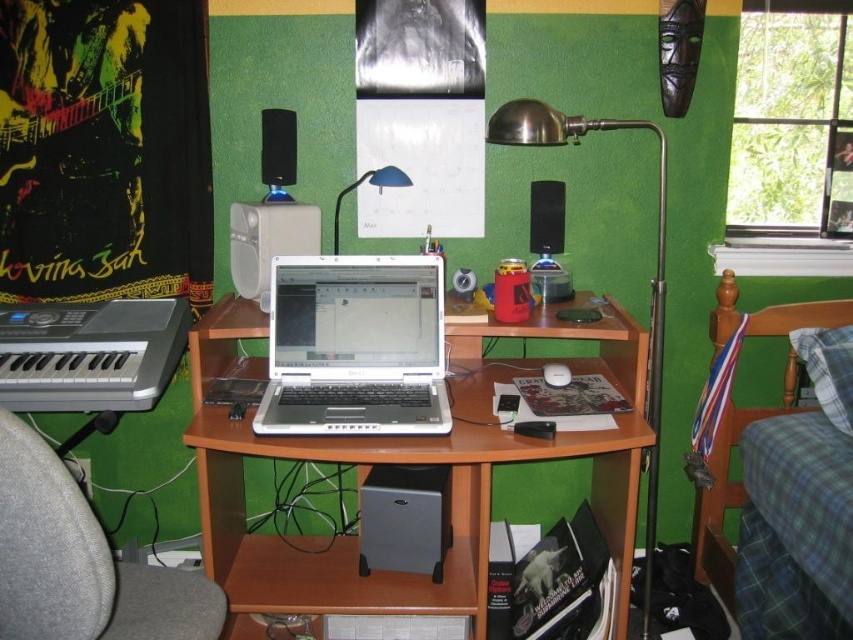
Question: Which point is closer to the camera?

Choices:
 (A) (723, 477)
 (B) (271, 163)
 (C) (393, 168)
 (D) (558, 244)

Answer: (C)

Question: Is gray fabric swivel chair at left bigger than black plastic speaker at upper center?

Choices:
 (A) no
 (B) yes

Answer: (B)

Question: Is gray fabric swivel chair at left behind blue metallic desk lamp at upper center?

Choices:
 (A) yes
 (B) no

Answer: (B)

Question: Which of the following is the farthest from the observer?

Choices:
 (A) gray fabric swivel chair at left
 (B) black plastic speaker at center
 (C) satin metal desk lamp at upper center

Answer: (B)

Question: Which of these objects is positioned farthest from the wooden computer desk at center?

Choices:
 (A) blue metallic desk lamp at upper center
 (B) silver metallic speaker at lower center

Answer: (A)

Question: Is the position of satin metal desk lamp at upper center more distant than that of blue metallic desk lamp at upper center?

Choices:
 (A) yes
 (B) no

Answer: (B)